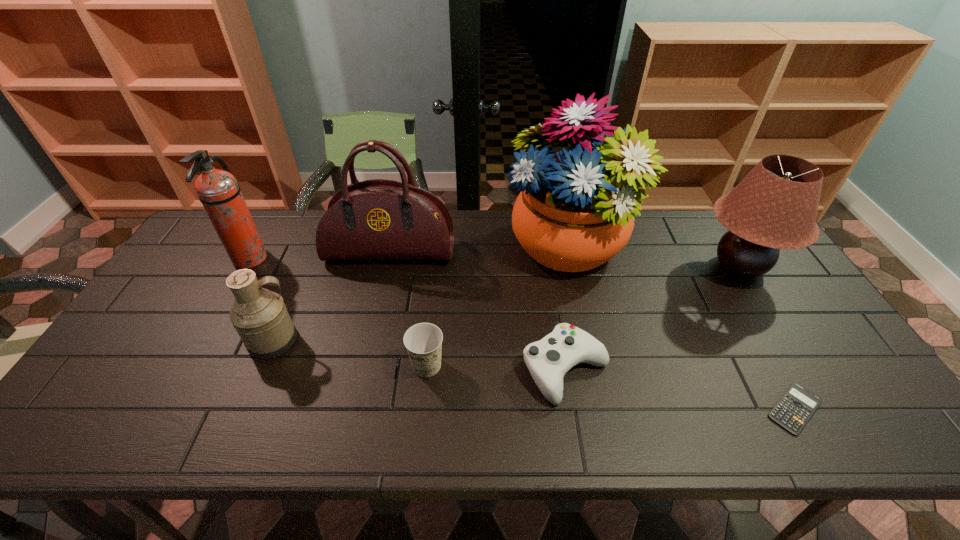
The image size is (960, 540). In the image, there is a desktop. What are the coordinates of `free space at the far edge` in the screenshot? It's located at (661, 218).

This screenshot has height=540, width=960. In the image, there is a desktop. Find the location of `free region at the near edge`. free region at the near edge is located at coordinates (409, 436).

Identify the location of free space at the left edge. The height and width of the screenshot is (540, 960). (142, 349).

At what (x,y) coordinates should I click in order to perform the action: click on free space that is in between the fifth tallest object and the lampshade. Please return your answer as a coordinate pair (x, y). Looking at the image, I should click on (506, 303).

At what (x,y) coordinates should I click in order to perform the action: click on empty space that is in between the lampshade and the shortest object. Please return your answer as a coordinate pair (x, y). This screenshot has width=960, height=540. Looking at the image, I should click on (767, 338).

Identify the location of free area in between the lampshade and the Dixie cup. This screenshot has width=960, height=540. (583, 316).

Find the location of a particular element. free space between the fifth tallest object and the third shortest object is located at coordinates (350, 353).

This screenshot has height=540, width=960. I want to click on free space between the calculator and the second shortest object, so click(x=680, y=389).

This screenshot has height=540, width=960. Find the location of `empty space that is in between the handbag and the pitcher`. empty space that is in between the handbag and the pitcher is located at coordinates (332, 296).

In order to click on free spot between the third shortest object and the fire extinguisher in this screenshot , I will do `click(338, 313)`.